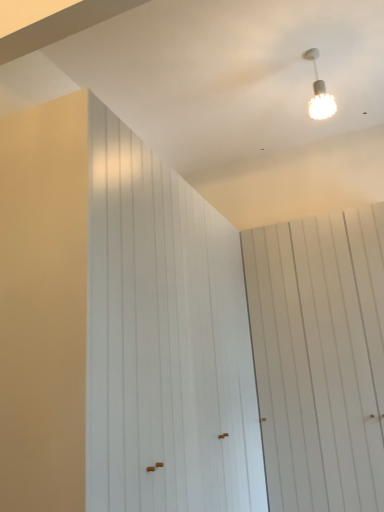
Question: From a real-world perspective, does white textured lampshade at upper right stand above white wood barn door at left, positioned as the 2th barn door in right-to-left order?

Choices:
 (A) no
 (B) yes

Answer: (B)

Question: Does white textured lampshade at upper right have a lesser width compared to white wood barn door at left, the first barn door viewed from the left?

Choices:
 (A) no
 (B) yes

Answer: (B)

Question: Is white textured lampshade at upper right outside white wood barn door at left, the first barn door viewed from the left?

Choices:
 (A) no
 (B) yes

Answer: (B)

Question: Considering the relative sizes of white textured lampshade at upper right and white wood barn door at left, the first barn door viewed from the left, in the image provided, is white textured lampshade at upper right bigger than white wood barn door at left, the first barn door viewed from the left,?

Choices:
 (A) no
 (B) yes

Answer: (A)

Question: From the image's perspective, would you say white textured lampshade at upper right is shown under white wood barn door at left, the first barn door viewed from the left?

Choices:
 (A) yes
 (B) no

Answer: (B)

Question: Is white textured lampshade at upper right taller than white wood barn door at left, the first barn door viewed from the left?

Choices:
 (A) no
 (B) yes

Answer: (A)

Question: Considering the relative positions of white wood barn door at left, the first barn door viewed from the left, and white wood barn door at upper right, the 2th barn door positioned from the left, in the image provided, is white wood barn door at left, the first barn door viewed from the left, behind white wood barn door at upper right, the 2th barn door positioned from the left,?

Choices:
 (A) yes
 (B) no

Answer: (B)

Question: Is white wood barn door at left, the first barn door viewed from the left, aimed at white wood barn door at upper right, the 2th barn door positioned from the left?

Choices:
 (A) no
 (B) yes

Answer: (B)

Question: Is white wood barn door at left, positioned as the 2th barn door in right-to-left order, far away from white wood barn door at upper right, the 1th barn door when ordered from right to left?

Choices:
 (A) no
 (B) yes

Answer: (A)

Question: Does white wood barn door at left, the first barn door viewed from the left, have a lesser height compared to white wood barn door at upper right, the 2th barn door positioned from the left?

Choices:
 (A) no
 (B) yes

Answer: (A)

Question: Can you confirm if white wood barn door at left, positioned as the 2th barn door in right-to-left order, is thinner than white wood barn door at upper right, the 2th barn door positioned from the left?

Choices:
 (A) no
 (B) yes

Answer: (A)

Question: Does white wood barn door at left, the first barn door viewed from the left, have a smaller size compared to white wood barn door at upper right, the 2th barn door positioned from the left?

Choices:
 (A) yes
 (B) no

Answer: (B)

Question: Does white textured lampshade at upper right have a greater width compared to white wood barn door at upper right, the 2th barn door positioned from the left?

Choices:
 (A) yes
 (B) no

Answer: (B)